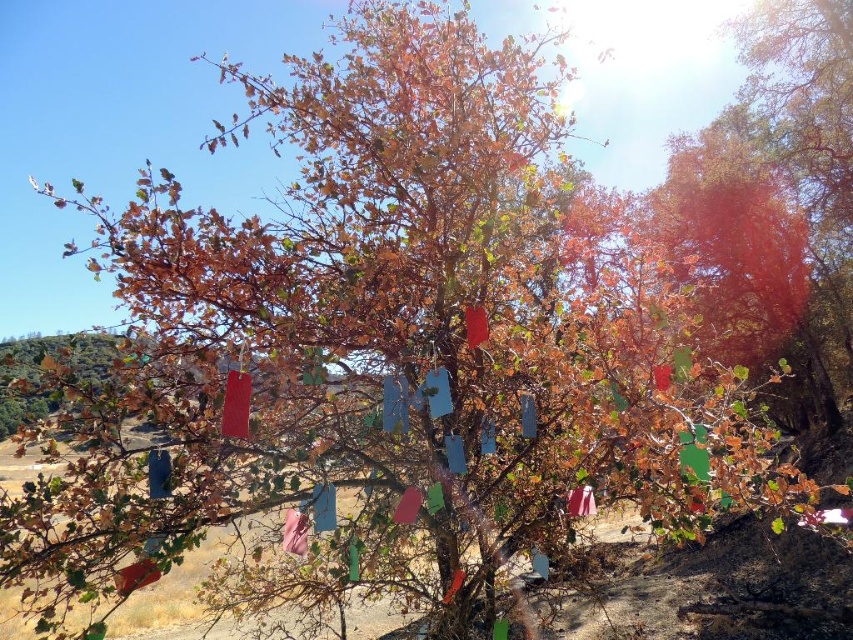
Which is behind, point (471, 339) or point (572, 496)?

Positioned behind is point (572, 496).

Who is lower down, red matte flag at center or pink fabric flag at center?

pink fabric flag at center

Does point (471, 337) lie behind point (585, 484)?

No, it is in front of (585, 484).

You are a GUI agent. You are given a task and a screenshot of the screen. Output one action in this format:
    pyautogui.click(x=<x>, y=<y>)
    Task: Click on the red matte flag at center
    This screenshot has width=853, height=640.
    Given the screenshot: What is the action you would take?
    pyautogui.click(x=474, y=324)

What do you see at coordinates (236, 404) in the screenshot? I see `matte red flag at center` at bounding box center [236, 404].

Is matte red flag at center thinner than matte red flag at lower left?

Yes, matte red flag at center is thinner than matte red flag at lower left.

Where is `matte red flag at center`? This screenshot has height=640, width=853. matte red flag at center is located at coordinates (236, 404).

Does matte red flag at lower left have a greater width compared to pink fabric flag at center?

No, matte red flag at lower left is not wider than pink fabric flag at center.

Does matte red flag at lower left appear under pink fabric flag at center?

Yes, matte red flag at lower left is below pink fabric flag at center.

Is point (141, 573) positioned in front of point (572, 513)?

Yes, point (141, 573) is closer to viewer.

This screenshot has width=853, height=640. In order to click on matte red flag at lower left in this screenshot , I will do `click(136, 576)`.